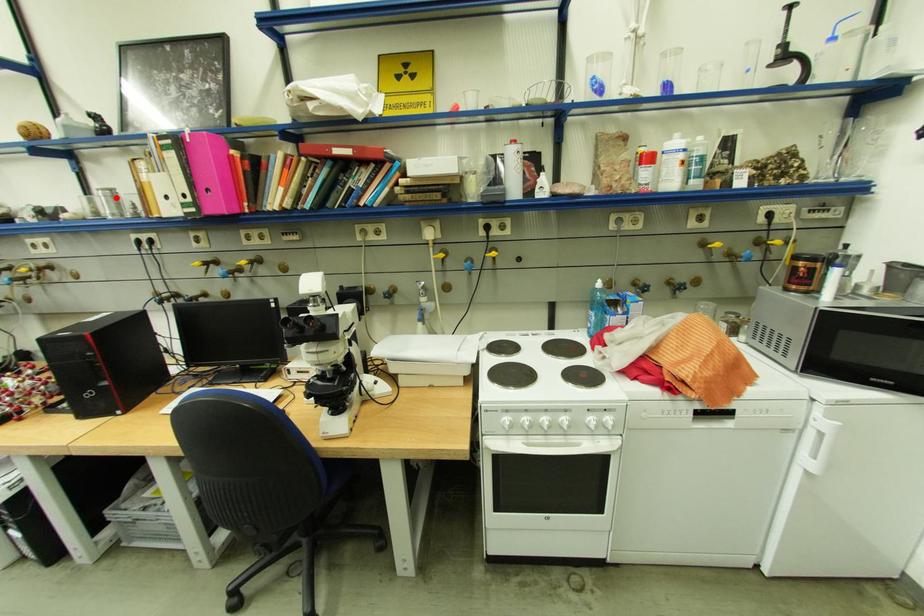
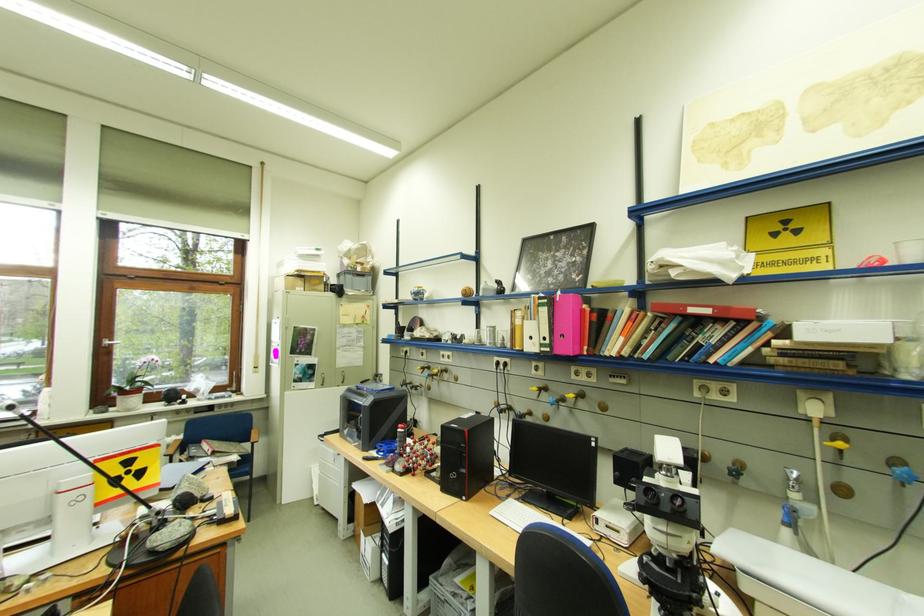
Where in the second image is the point corresponding to the highlighted location from the first image?

(500, 331)